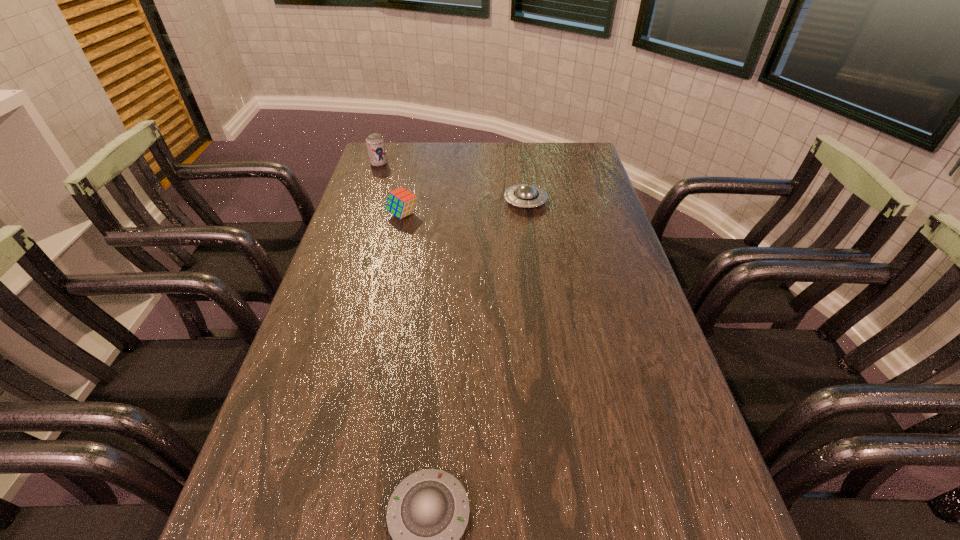
Identify the location of free space between the second shortest object and the tallest object. (452, 183).

Locate an element on the screen. The height and width of the screenshot is (540, 960). vacant area that lies between the taller saucer and the second object from left to right is located at coordinates (464, 208).

This screenshot has height=540, width=960. In order to click on free space between the rightmost object and the tallest object in this screenshot , I will do `click(452, 183)`.

At what (x,y) coordinates should I click in order to perform the action: click on unoccupied position between the cube and the right saucer. Please return your answer as a coordinate pair (x, y). The height and width of the screenshot is (540, 960). Looking at the image, I should click on (464, 208).

Where is `free point between the third object from right to left and the farther saucer`? The height and width of the screenshot is (540, 960). free point between the third object from right to left and the farther saucer is located at coordinates (464, 208).

This screenshot has height=540, width=960. Identify the location of free space between the leftmost object and the farther saucer. (452, 183).

At what (x,y) coordinates should I click in order to perform the action: click on free space between the cube and the taller saucer. Please return your answer as a coordinate pair (x, y). Looking at the image, I should click on (464, 208).

Identify which object is located as the third nearest to the beer can. Please provide its 2D coordinates. Your answer should be formatted as a tuple, i.e. [(x, y)], where the tuple contains the x and y coordinates of a point satisfying the conditions above.

[(427, 539)]

Select which object appears as the second closest to the farthest object. Please provide its 2D coordinates. Your answer should be formatted as a tuple, i.e. [(x, y)], where the tuple contains the x and y coordinates of a point satisfying the conditions above.

[(525, 195)]

Locate an element on the screen. free point that satisfies the following two spatial constraints: 1. on the front side of the leftmost object; 2. on the left side of the third shortest object is located at coordinates (362, 214).